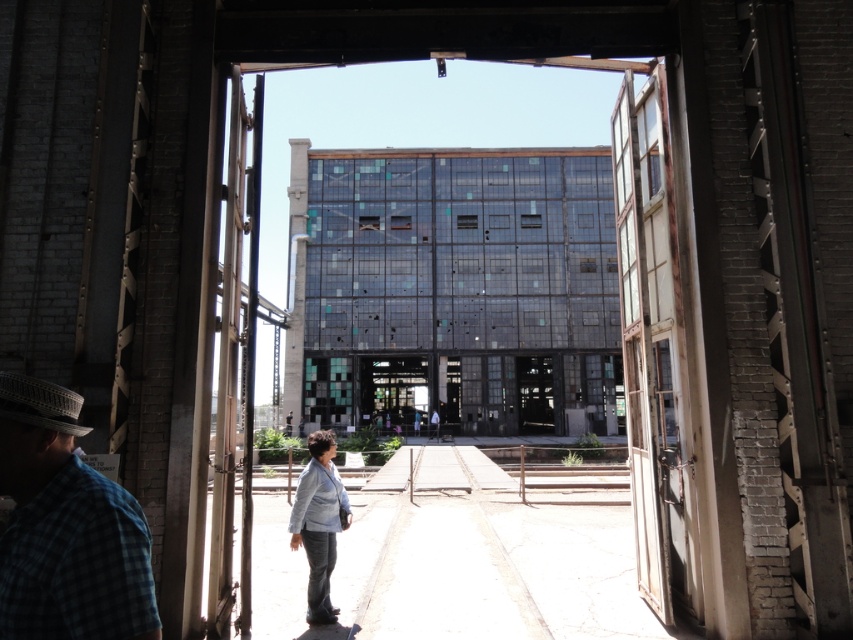
You are a tailor who needs to determine which item requires more fabric to repair. Based on the scene, which item would need more fabric, the blue plaid shirt at lower left or the white woven fedora at left?

The blue plaid shirt at lower left requires more fabric since it has a larger size compared to the white woven fedora at left.

You are standing at the entrance of the courtyard and want to reach the point marked as point (96, 524). The courtyard has a central walkway that is 5 feet wide. Can you walk directly to that point without stepping off the walkway?

The distance between you and point (96, 524) is 6.21 feet. Since the walkway is 5 feet wide, you can walk directly to the point as long as you stay within the walkway.